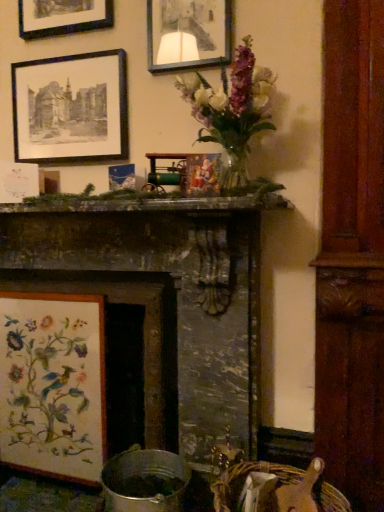
Find the location of a particular element. woven straw basket at lower right is located at coordinates (281, 489).

What is the approximate height of dark gray stone fireplace at center?

The height of dark gray stone fireplace at center is 1.14 meters.

In order to face matte glass picture frame at upper center, which appears as the third picture frame when ordered from the bottom, should I rotate leftwards or rightwards?

It's best to rotate left around 0.542 degrees.

What do you see at coordinates (188, 34) in the screenshot? I see `matte glass picture frame at upper center, which appears as the 1th picture frame when viewed from the top` at bounding box center [188, 34].

Describe the element at coordinates (71, 108) in the screenshot. I see `black paper picture frame at upper left, acting as the 2th picture frame starting from the bottom` at that location.

What do you see at coordinates (53, 384) in the screenshot? This screenshot has height=512, width=384. I see `wooden floral embroidery at lower left, the first picture frame from the bottom` at bounding box center [53, 384].

This screenshot has height=512, width=384. In order to click on woven straw basket at lower right in this screenshot , I will do `click(281, 489)`.

Is woven straw basket at lower right positioned with its back to wooden floral embroidery at lower left, which appears as the 3th picture frame when viewed from the top?

That's not correct — woven straw basket at lower right is not looking away from wooden floral embroidery at lower left, which appears as the 3th picture frame when viewed from the top.

From a real-world perspective, between woven straw basket at lower right and wooden floral embroidery at lower left, which appears as the 3th picture frame when viewed from the top, who is vertically higher?

wooden floral embroidery at lower left, which appears as the 3th picture frame when viewed from the top.

Is point (278, 490) closer to camera compared to point (5, 330)?

Yes, point (278, 490) is in front of point (5, 330).

From the image's perspective, would you say woven straw basket at lower right is positioned over wooden floral embroidery at lower left, the first picture frame from the bottom?

No, from the image's perspective, woven straw basket at lower right is not above wooden floral embroidery at lower left, the first picture frame from the bottom.

From a real-world perspective, who is located lower, dark gray stone fireplace at center or matte glass picture frame at upper center, which appears as the 1th picture frame when viewed from the top?

dark gray stone fireplace at center.

How different are the orientations of dark gray stone fireplace at center and matte glass picture frame at upper center, which appears as the third picture frame when ordered from the bottom, in degrees?

1.64 degrees separate the facing orientations of dark gray stone fireplace at center and matte glass picture frame at upper center, which appears as the third picture frame when ordered from the bottom.

In the scene shown: Is dark gray stone fireplace at center facing away from matte glass picture frame at upper center, which appears as the third picture frame when ordered from the bottom?

No, dark gray stone fireplace at center is not facing away from matte glass picture frame at upper center, which appears as the third picture frame when ordered from the bottom.

Does dark gray stone fireplace at center have a lesser width compared to matte glass picture frame at upper center, which appears as the 1th picture frame when viewed from the top?

No, dark gray stone fireplace at center is not thinner than matte glass picture frame at upper center, which appears as the 1th picture frame when viewed from the top.

Considering the points (191, 24) and (186, 376), which point is in front, point (191, 24) or point (186, 376)?

Positioned in front is point (191, 24).

Between matte glass picture frame at upper center, which appears as the 1th picture frame when viewed from the top, and dark gray stone fireplace at center, which one has more height?

With more height is dark gray stone fireplace at center.

Would you say dark gray stone fireplace at center is part of matte glass picture frame at upper center, which appears as the 1th picture frame when viewed from the top,'s contents?

Definitely not — dark gray stone fireplace at center is not inside matte glass picture frame at upper center, which appears as the 1th picture frame when viewed from the top.

In the scene shown: Is matte glass picture frame at upper center, which appears as the third picture frame when ordered from the bottom, next to wooden floral embroidery at lower left, which appears as the 3th picture frame when viewed from the top?

No, matte glass picture frame at upper center, which appears as the third picture frame when ordered from the bottom, is not touching wooden floral embroidery at lower left, which appears as the 3th picture frame when viewed from the top.

Is matte glass picture frame at upper center, which appears as the third picture frame when ordered from the bottom, taller than wooden floral embroidery at lower left, which appears as the 3th picture frame when viewed from the top?

No.

Which is correct: matte glass picture frame at upper center, which appears as the third picture frame when ordered from the bottom, is inside wooden floral embroidery at lower left, which appears as the 3th picture frame when viewed from the top, or outside of it?

matte glass picture frame at upper center, which appears as the third picture frame when ordered from the bottom, is outside wooden floral embroidery at lower left, which appears as the 3th picture frame when viewed from the top.

From the image's perspective, which is above, matte glass picture frame at upper center, which appears as the third picture frame when ordered from the bottom, or wooden floral embroidery at lower left, which appears as the 3th picture frame when viewed from the top?

matte glass picture frame at upper center, which appears as the third picture frame when ordered from the bottom, is shown above in the image.

Could you tell me if black paper picture frame at upper left, acting as the 2th picture frame starting from the bottom, is facing matte glass picture frame at upper center, which appears as the 1th picture frame when viewed from the top?

No, black paper picture frame at upper left, acting as the 2th picture frame starting from the bottom, is not aimed at matte glass picture frame at upper center, which appears as the 1th picture frame when viewed from the top.

Looking at this image, would you say matte glass picture frame at upper center, which appears as the 1th picture frame when viewed from the top, is part of black paper picture frame at upper left, acting as the 2th picture frame starting from the bottom,'s contents?

Result: Actually, matte glass picture frame at upper center, which appears as the 1th picture frame when viewed from the top, is outside black paper picture frame at upper left, acting as the 2th picture frame starting from the bottom.

Which of these two, black paper picture frame at upper left, acting as the 2th picture frame starting from the bottom, or matte glass picture frame at upper center, which appears as the 1th picture frame when viewed from the top, is smaller?

matte glass picture frame at upper center, which appears as the 1th picture frame when viewed from the top.

Considering the positions of point (57, 97) and point (190, 60), is point (57, 97) closer or farther from the camera than point (190, 60)?

Point (57, 97) appears to be farther away from the viewer than point (190, 60).

Find the location of a particular element. basket that is below the black paper picture frame at upper left, which is the 2th picture frame in top-to-bottom order (from the image's perspective) is located at coordinates (281, 489).

How much distance is there between black paper picture frame at upper left, acting as the 2th picture frame starting from the bottom, and woven straw basket at lower right?

A distance of 4.74 feet exists between black paper picture frame at upper left, acting as the 2th picture frame starting from the bottom, and woven straw basket at lower right.

Considering the positions of points (85, 132) and (345, 503), is point (85, 132) farther from camera compared to point (345, 503)?

Yes, it is behind point (345, 503).

Considering the relative positions of black paper picture frame at upper left, acting as the 2th picture frame starting from the bottom, and woven straw basket at lower right in the image provided, is black paper picture frame at upper left, acting as the 2th picture frame starting from the bottom, behind woven straw basket at lower right?

Yes, the depth of black paper picture frame at upper left, acting as the 2th picture frame starting from the bottom, is greater than that of woven straw basket at lower right.

From a real-world perspective, which object stands above the other?

matte glass picture frame at upper center, which appears as the third picture frame when ordered from the bottom.

Considering the relative positions of matte glass picture frame at upper center, which appears as the 1th picture frame when viewed from the top, and woven straw basket at lower right in the image provided, is matte glass picture frame at upper center, which appears as the 1th picture frame when viewed from the top, to the right of woven straw basket at lower right from the viewer's perspective?

Incorrect, matte glass picture frame at upper center, which appears as the 1th picture frame when viewed from the top, is not on the right side of woven straw basket at lower right.

Image resolution: width=384 pixels, height=512 pixels. I want to click on the 3rd picture frame above the woven straw basket at lower right (from the image's perspective), so click(x=188, y=34).

Is woven straw basket at lower right surrounded by matte glass picture frame at upper center, which appears as the third picture frame when ordered from the bottom?

No, matte glass picture frame at upper center, which appears as the third picture frame when ordered from the bottom, does not contain woven straw basket at lower right.

The image size is (384, 512). What are the coordinates of `basket below the wooden floral embroidery at lower left, the first picture frame from the bottom (from the image's perspective)` in the screenshot? It's located at (281, 489).

Find the location of a particular element. picture frame on the right of dark gray stone fireplace at center is located at coordinates [188, 34].

Looking at the image, which one is located closer to black paper picture frame at upper left, acting as the 2th picture frame starting from the bottom, matte glass picture frame at upper center, which appears as the 1th picture frame when viewed from the top, or dark gray stone fireplace at center?

Based on the image, matte glass picture frame at upper center, which appears as the 1th picture frame when viewed from the top, appears to be nearer to black paper picture frame at upper left, acting as the 2th picture frame starting from the bottom.

Considering their positions, is woven straw basket at lower right positioned closer to dark gray stone fireplace at center than black paper picture frame at upper left, acting as the 2th picture frame starting from the bottom?

The object closer to dark gray stone fireplace at center is woven straw basket at lower right.

Which object lies nearer to the anchor point wooden floral embroidery at lower left, which appears as the 3th picture frame when viewed from the top, dark gray stone fireplace at center or matte glass picture frame at upper center, which appears as the third picture frame when ordered from the bottom?

Among the two, dark gray stone fireplace at center is located nearer to wooden floral embroidery at lower left, which appears as the 3th picture frame when viewed from the top.

When comparing their distances from matte glass picture frame at upper center, which appears as the third picture frame when ordered from the bottom, does dark gray stone fireplace at center or wooden floral embroidery at lower left, the first picture frame from the bottom, seem further?

Among the two, wooden floral embroidery at lower left, the first picture frame from the bottom, is located further to matte glass picture frame at upper center, which appears as the third picture frame when ordered from the bottom.

Based on their spatial positions, is woven straw basket at lower right or black paper picture frame at upper left, acting as the 2th picture frame starting from the bottom, closer to wooden floral embroidery at lower left, the first picture frame from the bottom?

Based on the image, woven straw basket at lower right appears to be nearer to wooden floral embroidery at lower left, the first picture frame from the bottom.

From the picture: Estimate the real-world distances between objects in this image. Which object is further from wooden floral embroidery at lower left, which appears as the 3th picture frame when viewed from the top, black paper picture frame at upper left, acting as the 2th picture frame starting from the bottom, or woven straw basket at lower right?

black paper picture frame at upper left, acting as the 2th picture frame starting from the bottom.

Based on their spatial positions, is woven straw basket at lower right or black paper picture frame at upper left, which is the 2th picture frame in top-to-bottom order, further from matte glass picture frame at upper center, which appears as the third picture frame when ordered from the bottom?

Among the two, woven straw basket at lower right is located further to matte glass picture frame at upper center, which appears as the third picture frame when ordered from the bottom.

From the image, which object appears to be farther from woven straw basket at lower right, dark gray stone fireplace at center or matte glass picture frame at upper center, which appears as the third picture frame when ordered from the bottom?

matte glass picture frame at upper center, which appears as the third picture frame when ordered from the bottom, is further to woven straw basket at lower right.

Image resolution: width=384 pixels, height=512 pixels. What are the coordinates of `fireplace between black paper picture frame at upper left, which is the 2th picture frame in top-to-bottom order, and wooden floral embroidery at lower left, the first picture frame from the bottom, from top to bottom` in the screenshot? It's located at (175, 291).

In order to click on fireplace between wooden floral embroidery at lower left, which appears as the 3th picture frame when viewed from the top, and woven straw basket at lower right in this screenshot , I will do `click(175, 291)`.

Where is `fireplace between black paper picture frame at upper left, acting as the 2th picture frame starting from the bottom, and woven straw basket at lower right vertically`? fireplace between black paper picture frame at upper left, acting as the 2th picture frame starting from the bottom, and woven straw basket at lower right vertically is located at coordinates (175, 291).

Where is `picture frame between black paper picture frame at upper left, acting as the 2th picture frame starting from the bottom, and woven straw basket at lower right vertically`? picture frame between black paper picture frame at upper left, acting as the 2th picture frame starting from the bottom, and woven straw basket at lower right vertically is located at coordinates (53, 384).